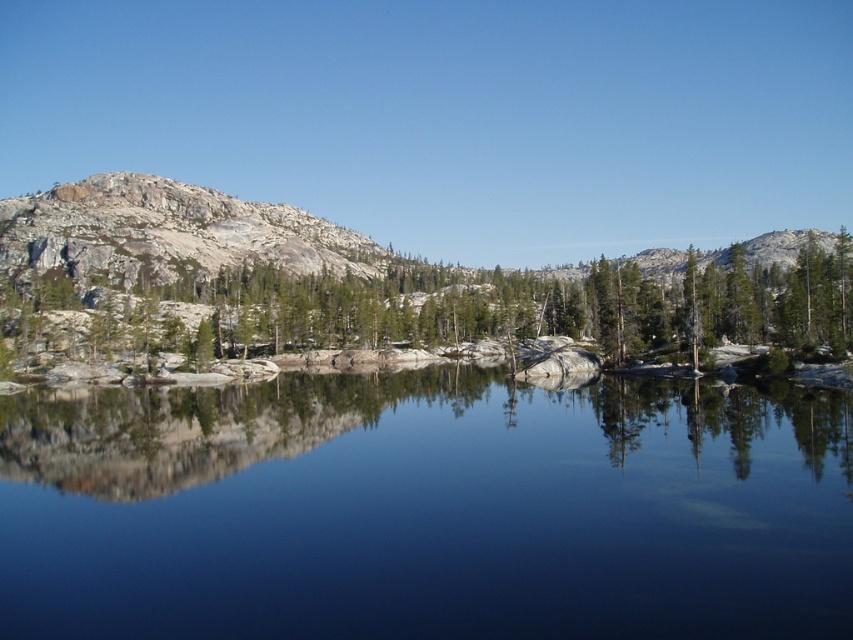
Between transparent glass lake at center and granite rock formation at left, which one appears on the left side from the viewer's perspective?

Positioned to the left is granite rock formation at left.

Is point (265, 488) farther from viewer compared to point (154, 202)?

No.

Between point (616, 380) and point (77, 248), which one is positioned behind?

Positioned behind is point (77, 248).

I want to click on transparent glass lake at center, so point(426,509).

Between transparent glass lake at center and green textured rock at left, which one has less height?

transparent glass lake at center is shorter.

Looking at this image, is transparent glass lake at center positioned before green textured rock at left?

Yes, transparent glass lake at center is in front of green textured rock at left.

Identify the location of transparent glass lake at center. This screenshot has width=853, height=640. (426, 509).

I want to click on transparent glass lake at center, so click(x=426, y=509).

Is green textured rock at left positioned at the back of granite rock formation at left?

No, it is in front of granite rock formation at left.

Who is more forward, (541, 282) or (90, 232)?

Point (90, 232) is more forward.

Find the location of a particular element. This screenshot has width=853, height=640. green textured rock at left is located at coordinates (447, 310).